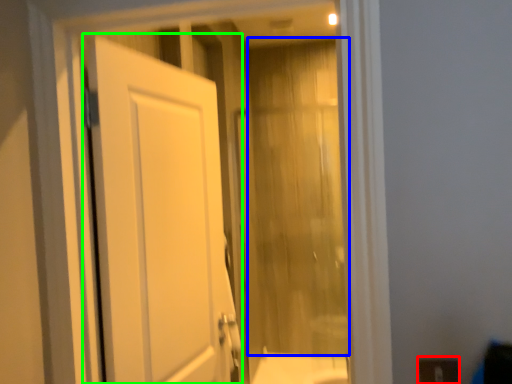
Question: Which object is the closest to the electric outlet (highlighted by a red box)? Choose among these: curtain (highlighted by a blue box) or door (highlighted by a green box).

Choices:
 (A) curtain
 (B) door

Answer: (B)